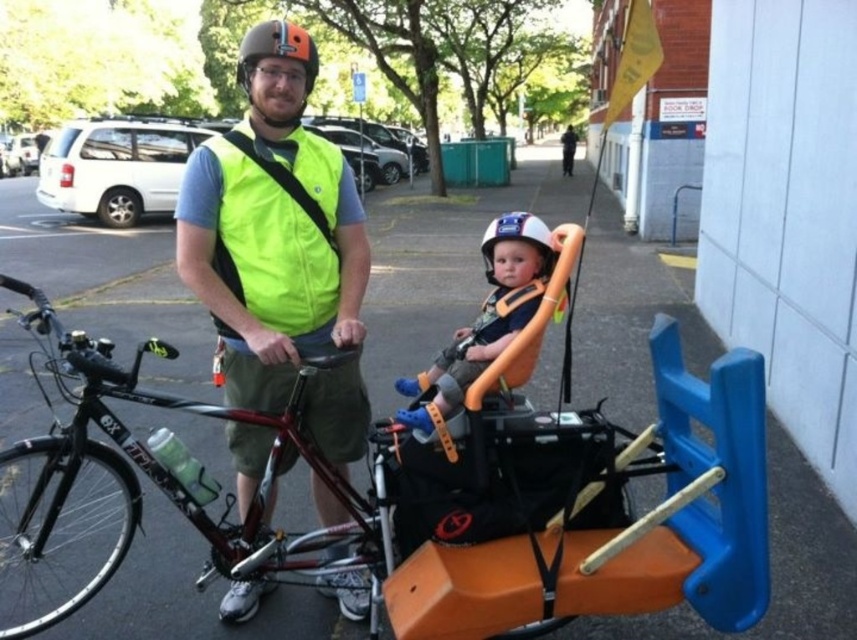
Which is in front, point (351, 394) or point (453, 364)?

Point (453, 364) is more forward.

Between neon yellow vest at center and matte orange helmet at center, which one appears on the right side from the viewer's perspective?

Positioned to the right is matte orange helmet at center.

The width and height of the screenshot is (857, 640). Describe the element at coordinates (279, 246) in the screenshot. I see `neon yellow vest at center` at that location.

This screenshot has width=857, height=640. What are the coordinates of `neon yellow vest at center` in the screenshot? It's located at (279, 246).

Who is more forward, (496, 349) or (518, 225)?

Point (496, 349)

Measure the distance between point (502, 237) and camera.

Point (502, 237) and camera are 6.62 feet apart.

Locate an element on the screen. matte orange helmet at center is located at coordinates (490, 307).

In order to click on matte orange helmet at center in this screenshot , I will do `click(490, 307)`.

Between matte orange helmet at center and matte orange helmet at upper center, which one appears on the right side from the viewer's perspective?

matte orange helmet at center

Can you confirm if matte orange helmet at center is positioned to the left of matte orange helmet at upper center?

In fact, matte orange helmet at center is to the right of matte orange helmet at upper center.

Find the location of `matte orange helmet at center`. matte orange helmet at center is located at coordinates (490, 307).

Find the location of a particular element. matte orange helmet at center is located at coordinates (490, 307).